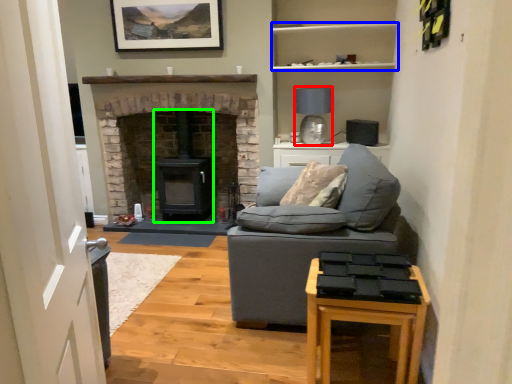
Question: Based on their relative distances, which object is nearer to lamp (highlighted by a red box)? Choose from shelf (highlighted by a blue box) and wood burning stove (highlighted by a green box).

Choices:
 (A) shelf
 (B) wood burning stove

Answer: (A)